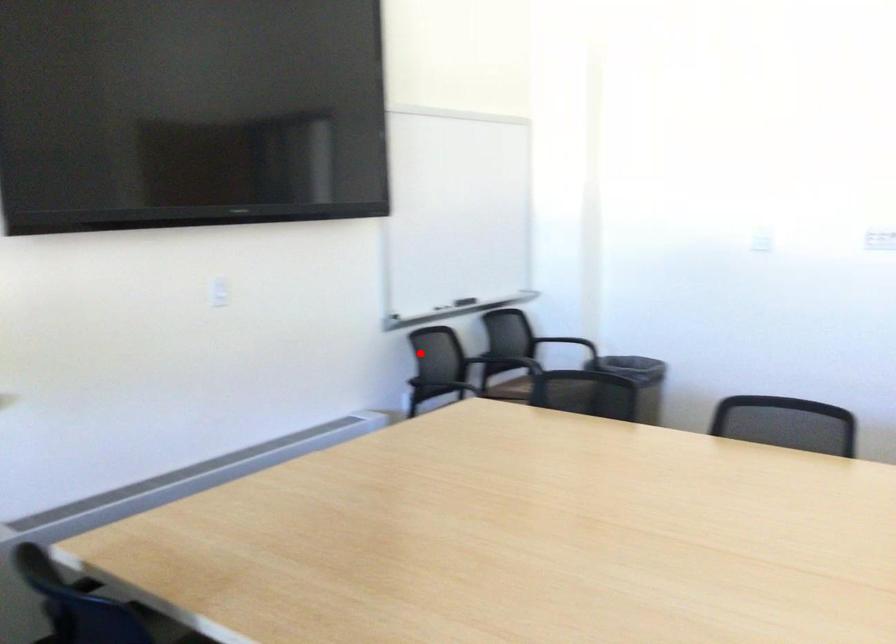
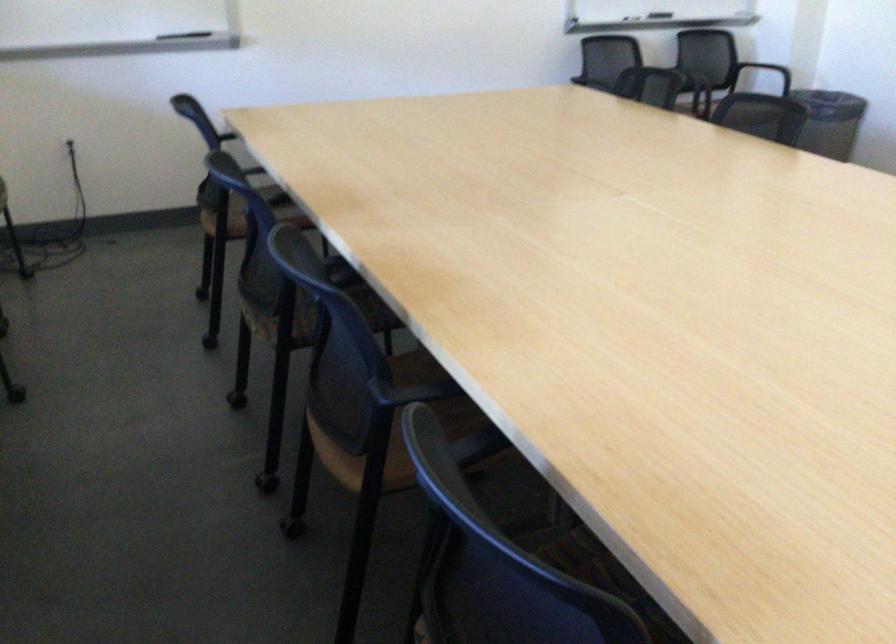
In the second image, find the point that corresponds to the highlighted location in the first image.

(607, 57)